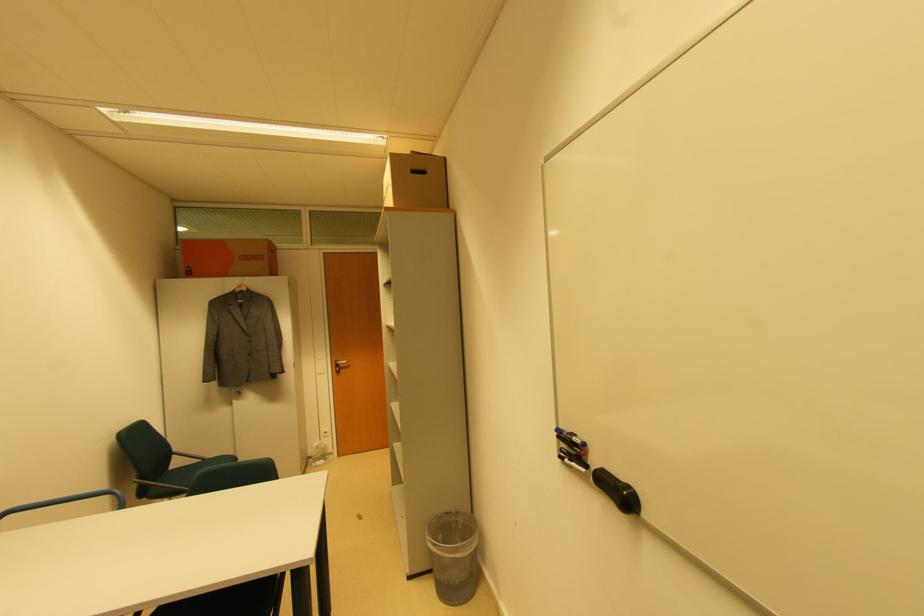
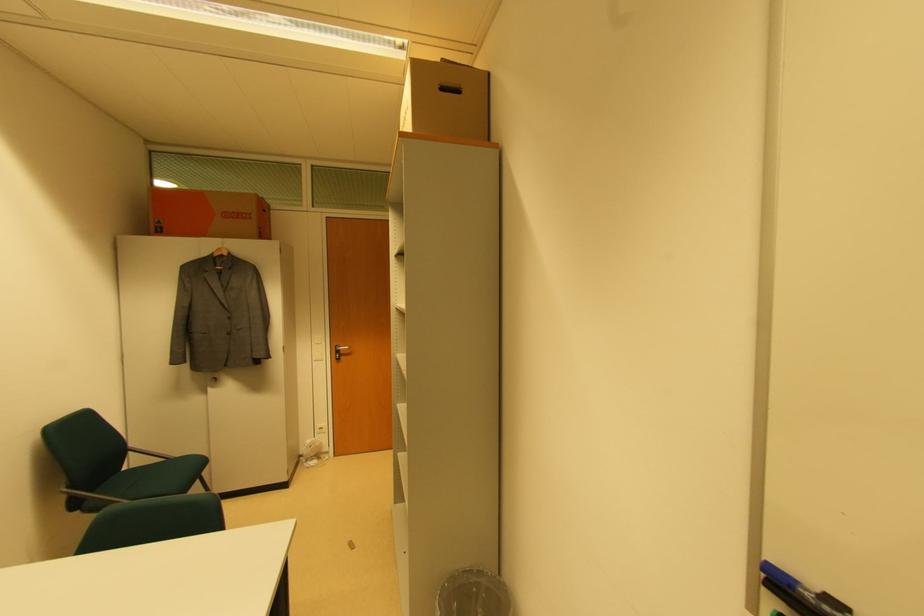
Locate, in the second image, the point that corresponds to point 337,363 in the first image.

(337, 349)